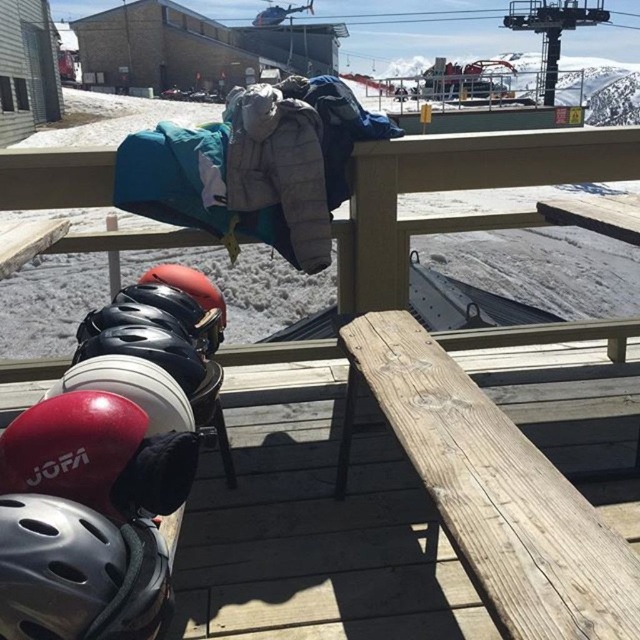
You are a ski instructor preparing to distribute helmets to children. You have two helmets available in the scene, the shiny red helmet at lower left and the shiny black helmet at left. Which helmet would be more suitable for a child who needs a smaller helmet?

The shiny red helmet at lower left is smaller in width than the shiny black helmet at left, so it would be more suitable for a child needing a smaller helmet.